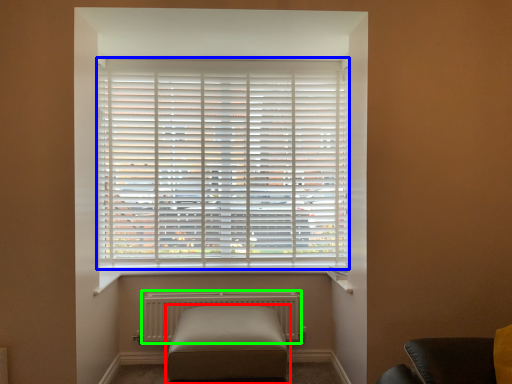
Question: Based on their relative distances, which object is farther from furniture (highlighted by a red box)? Choose from window blind (highlighted by a blue box) and radiator (highlighted by a green box).

Choices:
 (A) window blind
 (B) radiator

Answer: (A)